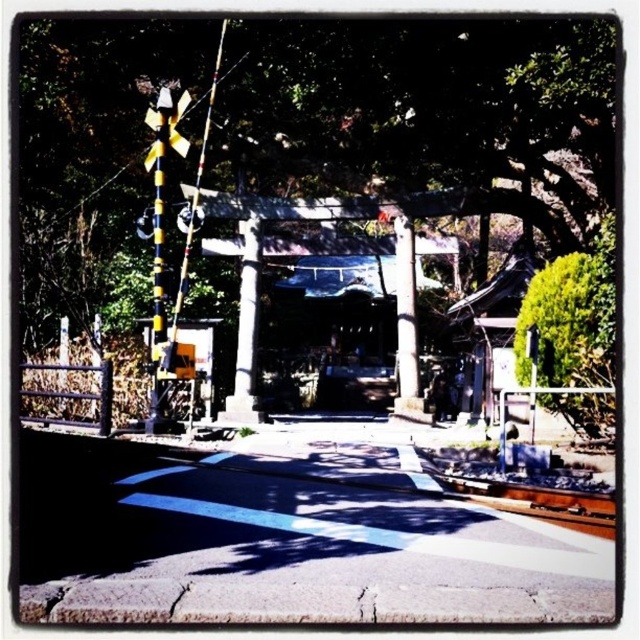
You are standing at the entrance of the shrine and notice a green leafy tree at upper center. Can you determine its exact position relative to the torii gate and the railway crossing signal?

The green leafy tree at upper center is located at point coordinates of 0.284 on the x axis and 0.483 on the y axis.